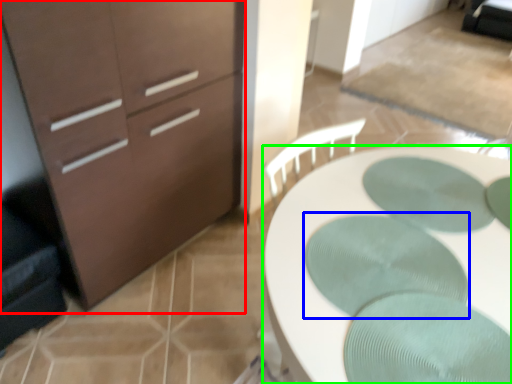
Question: Which object is the farthest from chest of drawers (highlighted by a red box)? Choose among these: oval (highlighted by a blue box) or desk (highlighted by a green box).

Choices:
 (A) oval
 (B) desk

Answer: (A)